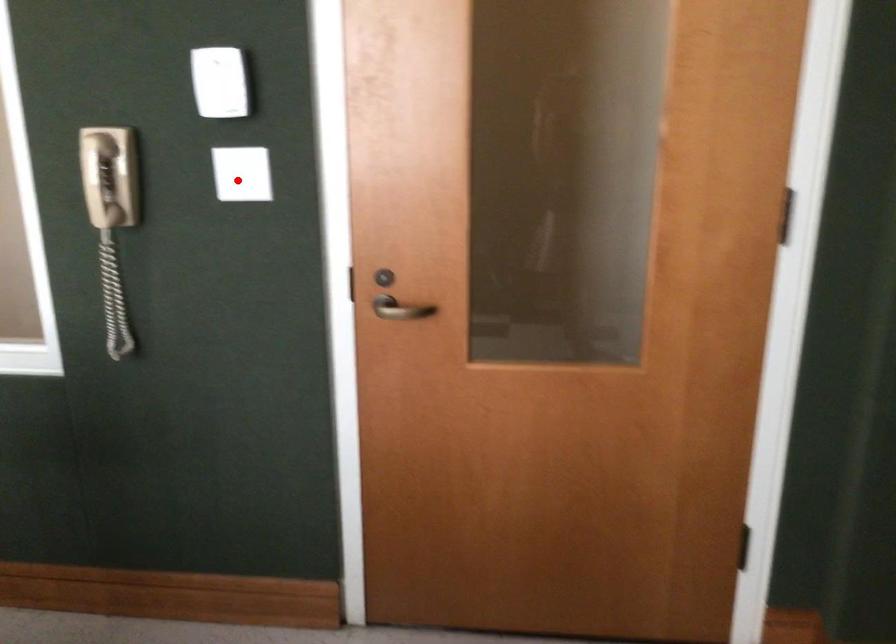
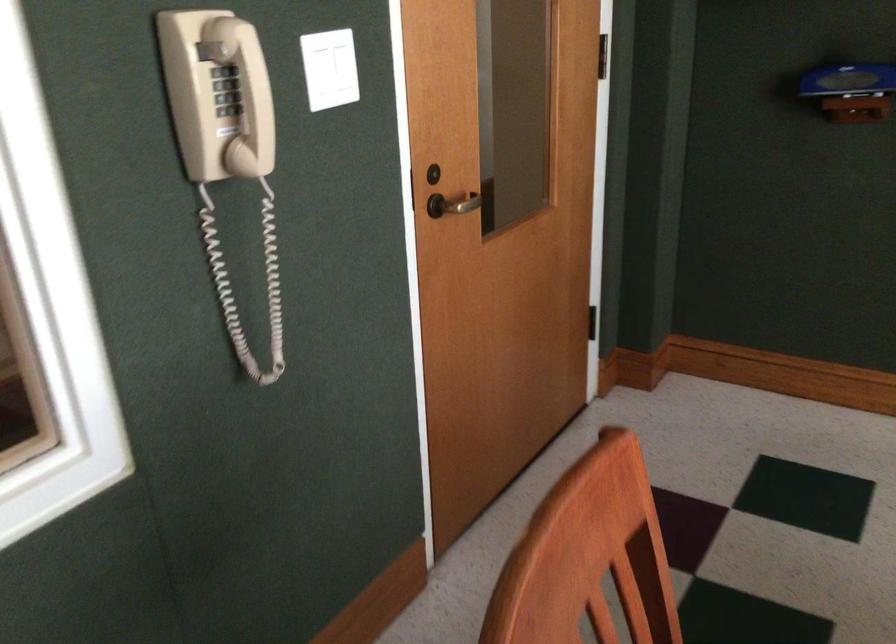
Question: A red point is marked in image1. In image2, is the corresponding 3D point closer to the camera or farther? Reply with the corresponding letter.

Choices:
 (A) The corresponding 3D point is closer.
 (B) The corresponding 3D point is farther.

Answer: (A)